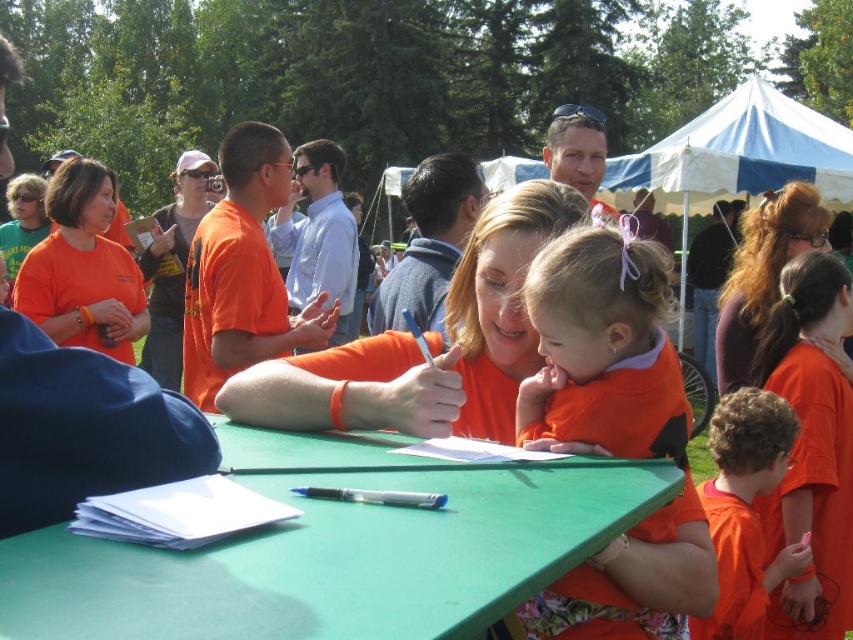
Question: Does green plastic table at center have a lesser width compared to orange soft fabric baby at center?

Choices:
 (A) no
 (B) yes

Answer: (A)

Question: Which object is the closest to the green plastic table at center?

Choices:
 (A) orange soft fabric baby at center
 (B) orange matte shirt at lower right

Answer: (A)

Question: Which point is farther to the camera?

Choices:
 (A) (637, 256)
 (B) (746, 547)
 (C) (613, 460)

Answer: (B)

Question: Is orange soft fabric baby at center to the right of orange matte shirt at lower right from the viewer's perspective?

Choices:
 (A) no
 (B) yes

Answer: (A)

Question: Which of the following is the farthest from the observer?

Choices:
 (A) orange soft fabric baby at center
 (B) green plastic table at center

Answer: (A)

Question: Does green plastic table at center appear over orange soft fabric baby at center?

Choices:
 (A) no
 (B) yes

Answer: (B)